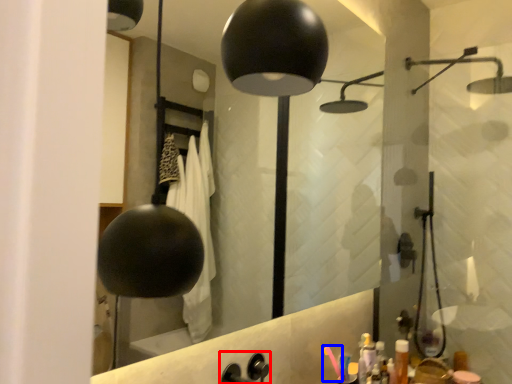
Question: Among these objects, which one is farthest to the camera, faucet (highlighted by a red box) or toothbrush (highlighted by a blue box)?

Choices:
 (A) faucet
 (B) toothbrush

Answer: (B)